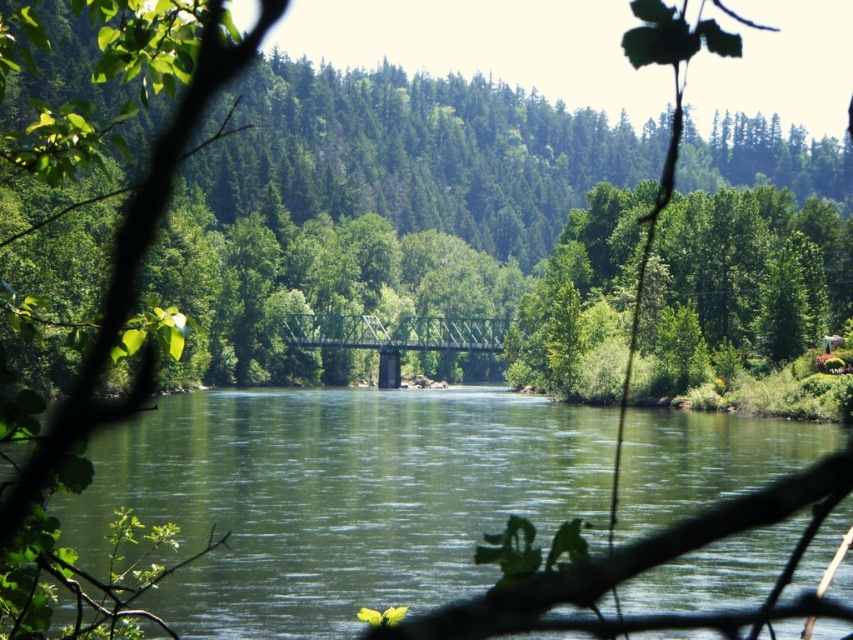
You are standing at the point labeled point [373,529] and want to walk towards the point labeled point [76,410]. Based on the scene description, which direction should you move to get closer to your destination?

You should move away from the viewer because point [373,529] is closer to the viewer than point [76,410], so moving away will bring you closer to the destination.

You are a photographer standing behind a green leafy tree at center and want to take a photo of the green metallic bridge at center. Can you see the entire bridge clearly through the tree?

The green leafy tree at center is in front of the green metallic bridge at center, so you cannot see the entire bridge clearly through the tree.